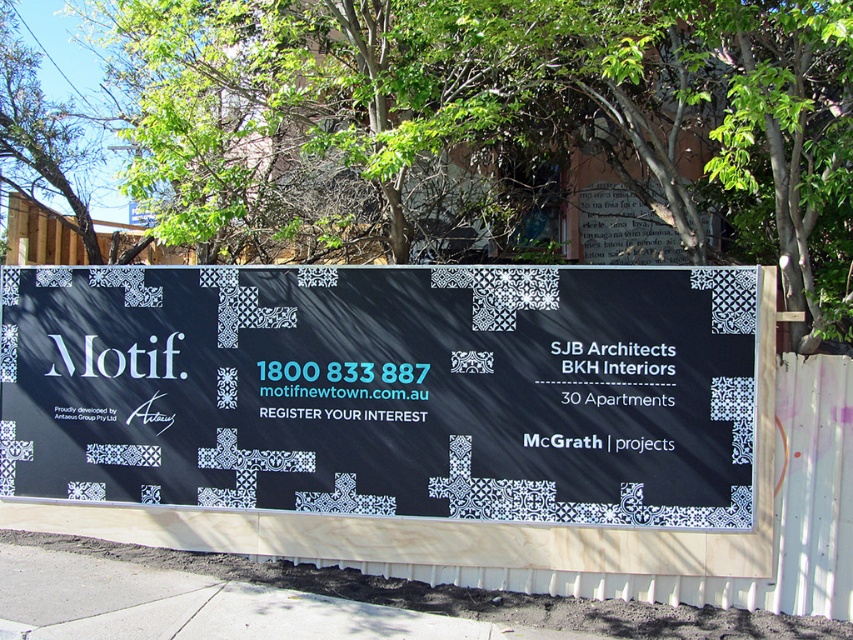
Question: Which point is farther to the camera?

Choices:
 (A) (247, 444)
 (B) (653, 586)
 (C) (338, 161)
 (D) (180, 557)

Answer: (C)

Question: Observing the image, what is the correct spatial positioning of black matte sign at center in reference to wooden at center?

Choices:
 (A) right
 (B) left

Answer: (B)

Question: Estimate the real-world distances between objects in this image. Which object is farther from the concrete pavement at lower center?

Choices:
 (A) wooden at center
 (B) green leafy tree at upper center
 (C) black matte sign at center

Answer: (B)

Question: From the image, what is the correct spatial relationship of green leafy tree at upper center in relation to concrete pavement at lower center?

Choices:
 (A) left
 (B) right

Answer: (A)

Question: Which point is farther to the camera?

Choices:
 (A) concrete pavement at lower center
 (B) wooden at center
 (C) green leafy tree at upper center

Answer: (B)

Question: Is black matte sign at center to the right of green leafy tree at upper center from the viewer's perspective?

Choices:
 (A) yes
 (B) no

Answer: (B)